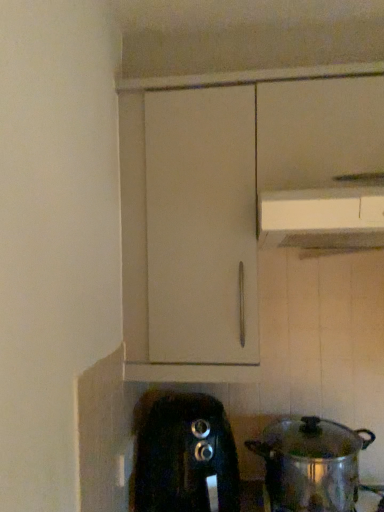
Question: From the image's perspective, is white plastic vent at upper center located above or below shiny metallic pot at lower right?

Choices:
 (A) below
 (B) above

Answer: (B)

Question: Considering the positions of white plastic vent at upper center and shiny metallic pot at lower right in the image, is white plastic vent at upper center wider or thinner than shiny metallic pot at lower right?

Choices:
 (A) wide
 (B) thin

Answer: (A)

Question: Estimate the real-world distances between objects in this image. Which object is farther from the white plastic vent at upper center?

Choices:
 (A) shiny metallic pot at lower right
 (B) black plastic toaster at lower center

Answer: (A)

Question: Based on their relative distances, which object is nearer to the shiny metallic pot at lower right?

Choices:
 (A) black plastic toaster at lower center
 (B) white plastic vent at upper center

Answer: (A)